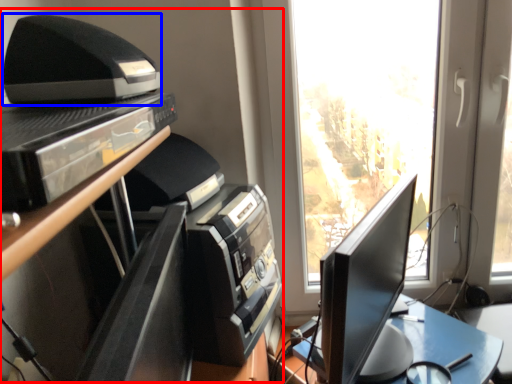
Question: Which object is further to the camera taking this photo, entertainment center (highlighted by a red box) or printer (highlighted by a blue box)?

Choices:
 (A) entertainment center
 (B) printer

Answer: (A)